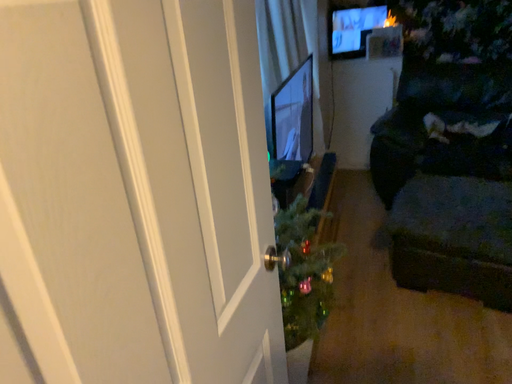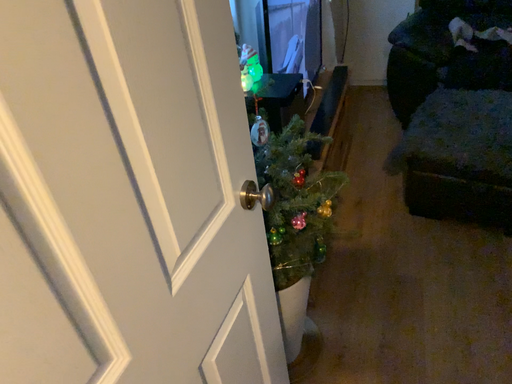
Question: Which way did the camera rotate in the video?

Choices:
 (A) rotated upward
 (B) rotated downward

Answer: (B)